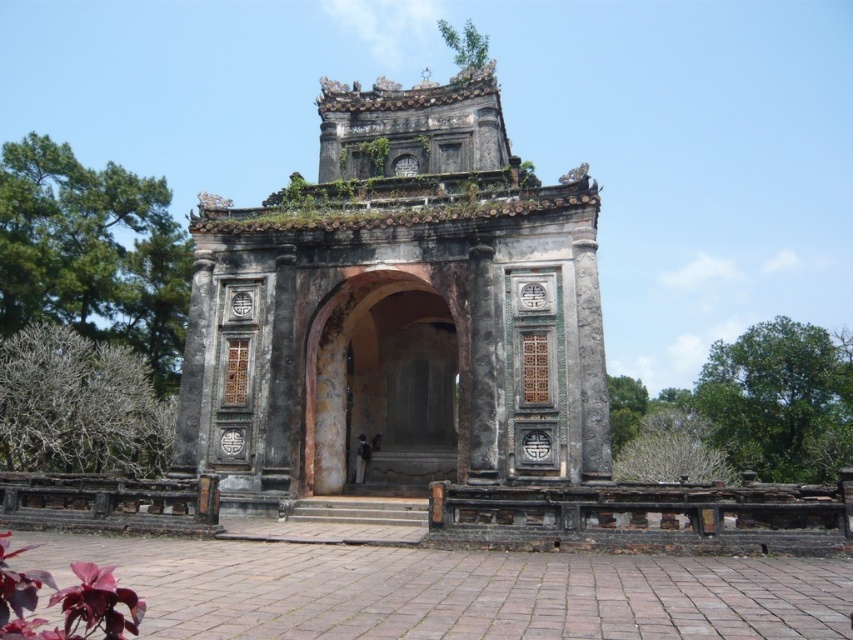
You are standing in front of the historical tomb and notice two trees. One is the bare branches at left and the other is the green leafy tree at right. Which tree is positioned more to the east if the tomb faces north?

The green leafy tree at right is positioned more to the east because if the tomb faces north, the right side would correspond to the east direction, so the green leafy tree at right is to the east of the bare branches at left.